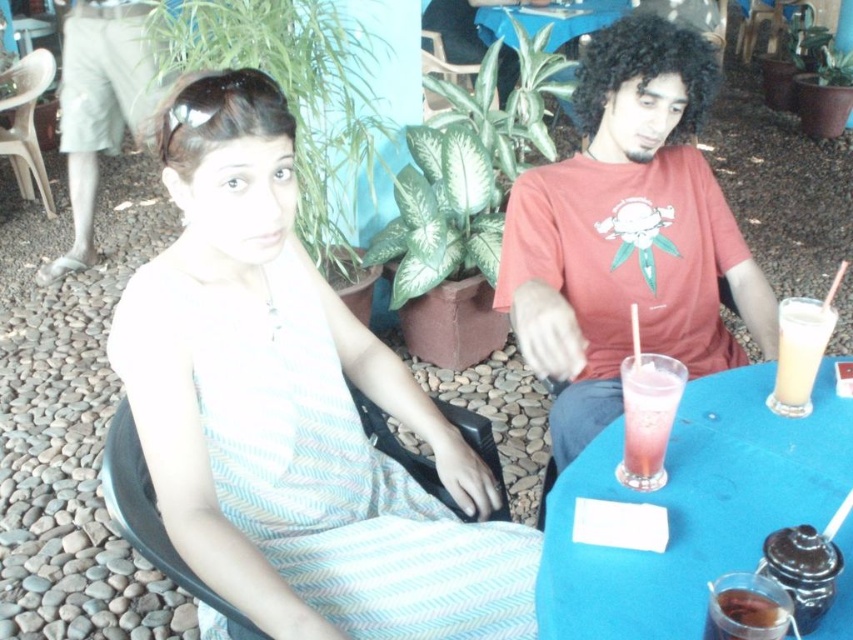
You are a server at the outdoor table. You need to place a new drink order on the table. Which object, the blue plastic table at center or the pink translucent glass at center, should you place the drink on to ensure it is stable?

You should place the drink on the blue plastic table at center because it has a greater height compared to the pink translucent glass at center, making it a more stable surface for placing the drink.

You are a server at the outdoor table. You need to place a 14 cm wide menu between the blue plastic table at center and the pink translucent glass at center. Can you fit it there without overlapping either?

The distance between the blue plastic table at center and the pink translucent glass at center is 15.09 centimeters. Since the menu is 14 cm wide, it can fit between them without overlapping as 14 cm is less than 15.09 cm.